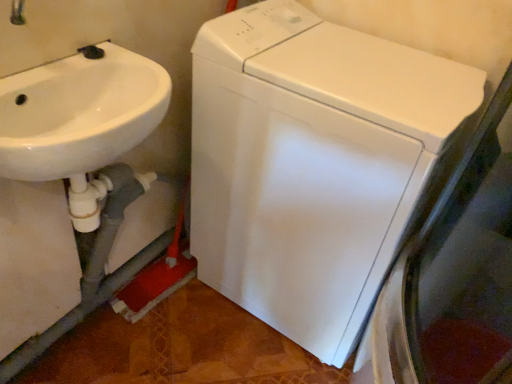
Question: Would you say white glossy washing machine at center is to the left or to the right of white glossy sink at left in the picture?

Choices:
 (A) right
 (B) left

Answer: (A)

Question: From a real-world perspective, is white glossy washing machine at center positioned above or below white glossy sink at left?

Choices:
 (A) below
 (B) above

Answer: (A)

Question: Considering the positions of white glossy washing machine at center and white glossy sink at left in the image, is white glossy washing machine at center bigger or smaller than white glossy sink at left?

Choices:
 (A) big
 (B) small

Answer: (A)

Question: Based on their sizes in the image, would you say white glossy sink at left is bigger or smaller than white glossy washing machine at center?

Choices:
 (A) big
 (B) small

Answer: (B)

Question: Does point (96, 129) appear closer or farther from the camera than point (336, 329)?

Choices:
 (A) closer
 (B) farther

Answer: (A)

Question: From the image's perspective, is white glossy sink at left above or below white glossy washing machine at center?

Choices:
 (A) below
 (B) above

Answer: (B)

Question: Would you say white glossy sink at left is to the left or to the right of white glossy washing machine at center in the picture?

Choices:
 (A) left
 (B) right

Answer: (A)